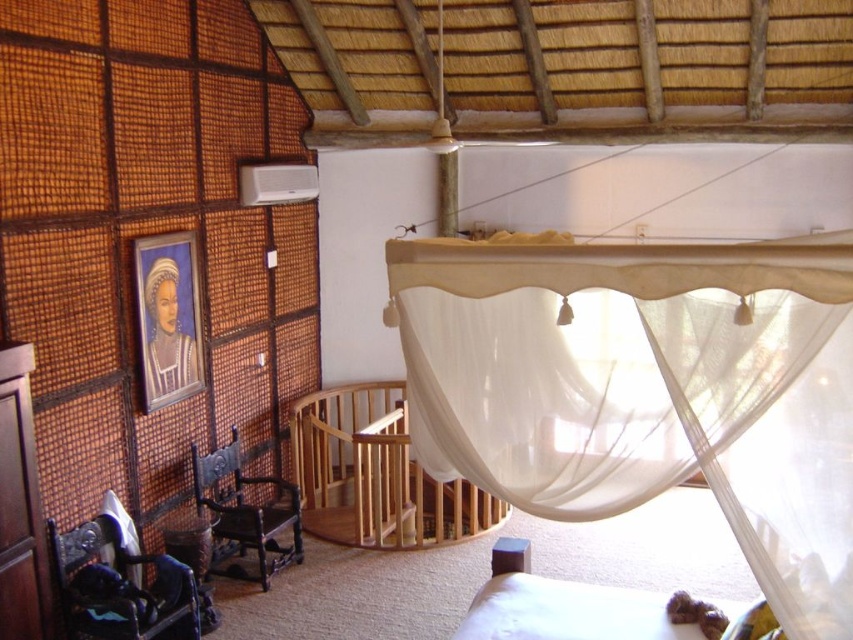
Is the position of metallic blue chair at lower left less distant than that of dark brown wood chair at left?

That is True.

The height and width of the screenshot is (640, 853). I want to click on metallic blue chair at lower left, so point(120,588).

Identify the location of metallic blue chair at lower left. (120, 588).

Can you confirm if white sheer curtain at center is wider than dark brown wood chair at left?

Yes, white sheer curtain at center is wider than dark brown wood chair at left.

Does white sheer curtain at center have a lesser height compared to dark brown wood chair at left?

No, white sheer curtain at center is not shorter than dark brown wood chair at left.

Who is more forward, (521, 468) or (223, 461)?

Point (521, 468) is more forward.

Where is `white sheer curtain at center`? This screenshot has height=640, width=853. white sheer curtain at center is located at coordinates (646, 388).

In the scene shown: Is white sheer curtain at center to the right of wooden crib at center from the viewer's perspective?

Indeed, white sheer curtain at center is positioned on the right side of wooden crib at center.

Who is more distant from viewer, (796, 426) or (376, 380)?

Positioned behind is point (376, 380).

Which is behind, point (804, 502) or point (315, 525)?

Point (315, 525)

Locate an element on the screen. Image resolution: width=853 pixels, height=640 pixels. white sheer curtain at center is located at coordinates (646, 388).